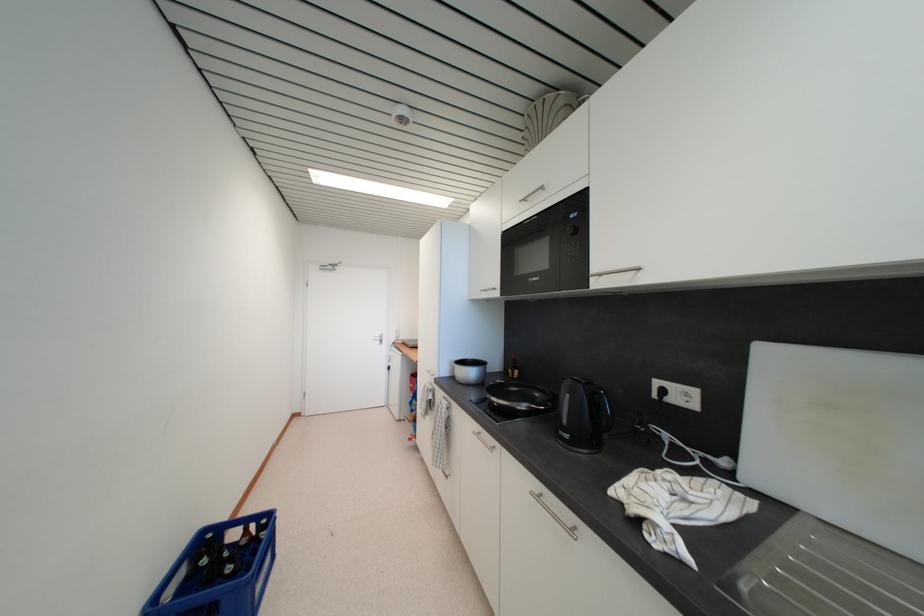
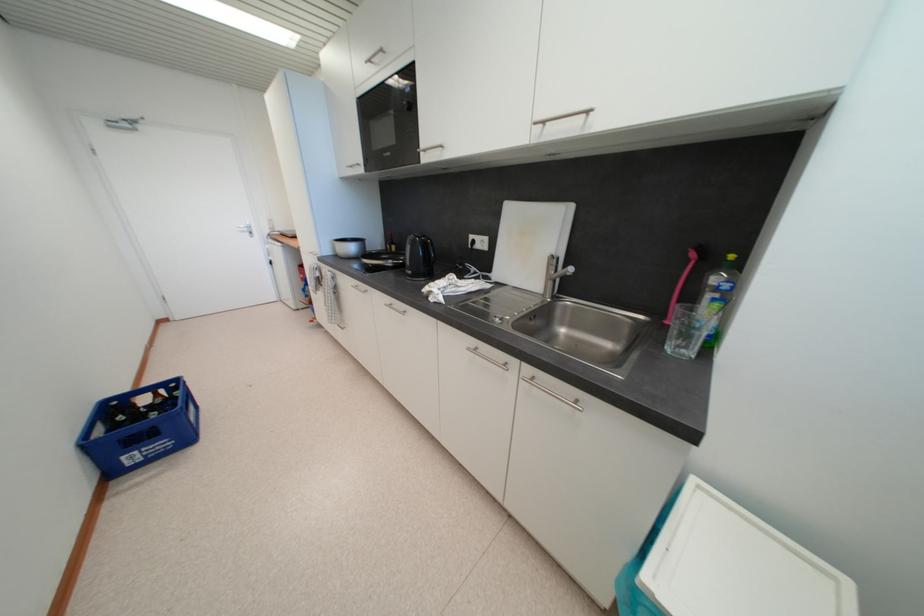
In the second image, find the point that corresponds to (x=572, y=439) in the first image.

(415, 275)